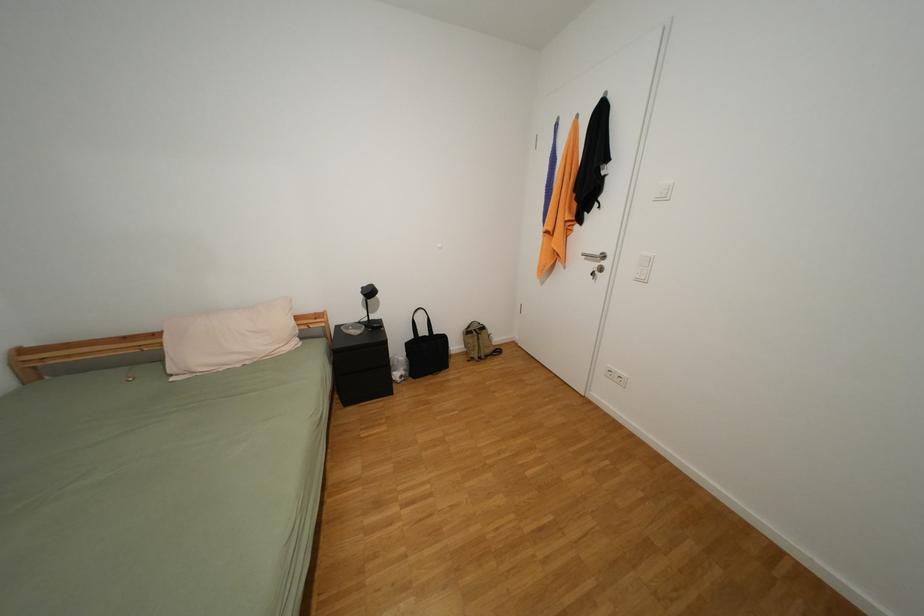
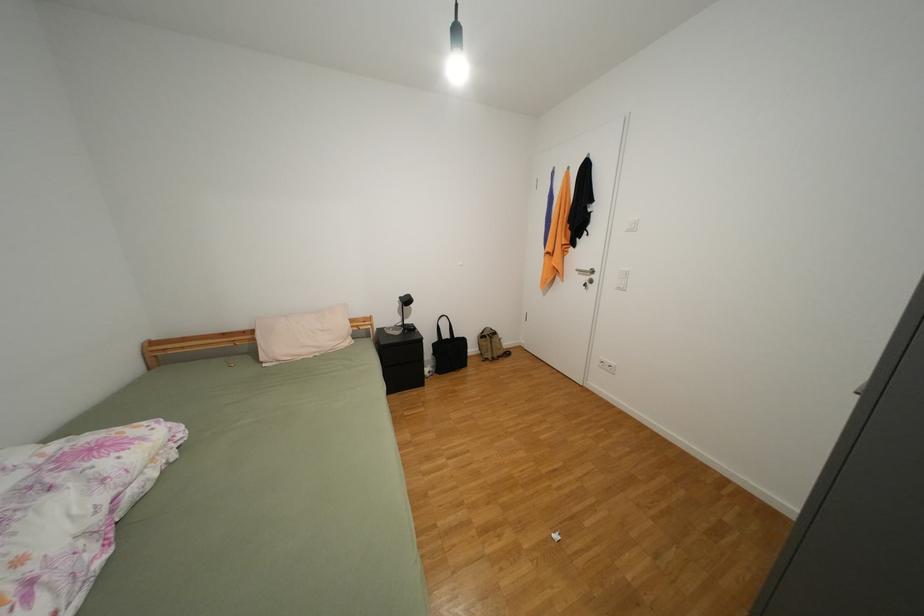
Question: Based on the continuous images, in which direction is the camera rotating? Reply with the corresponding letter.

Choices:
 (A) Left
 (B) Right
 (C) Up
 (D) Down

Answer: (C)